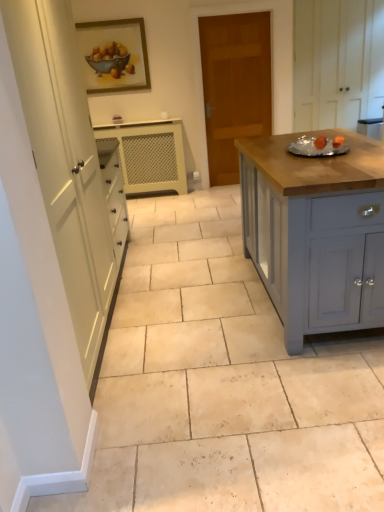
Question: In the image, is white textured cabinet at center, which is counted as the 3th cabinetry, starting from the right, positioned in front of or behind white wood cabinet at upper right, the third cabinetry ordered from the bottom?

Choices:
 (A) front
 (B) behind

Answer: (B)

Question: Is white textured cabinet at center, which is the second cabinetry from top to bottom, to the left or to the right of white wood cabinet at upper right, the 2th cabinetry in the front-to-back sequence, in the image?

Choices:
 (A) right
 (B) left

Answer: (B)

Question: Considering the real-world distances, which object is closest to the white textured cabinet at center, which is the 1th cabinetry in back-to-front order?

Choices:
 (A) white tile floor at center
 (B) white wood cabinet at upper right, which is the 2th cabinetry in back-to-front order
 (C) wooden framed painting at upper center
 (D) wooden door at center
 (E) matte gray cabinet at right, which appears as the third cabinetry when viewed from the top

Answer: (C)

Question: Estimate the real-world distances between objects in this image. Which object is farther from the white textured cabinet at center, which is the second cabinetry from top to bottom?

Choices:
 (A) wooden door at center
 (B) white wood cabinet at upper right, which is the 2th cabinetry in back-to-front order
 (C) wooden framed painting at upper center
 (D) matte gray cabinet at right, the 1th cabinetry when ordered from front to back
 (E) white tile floor at center

Answer: (D)